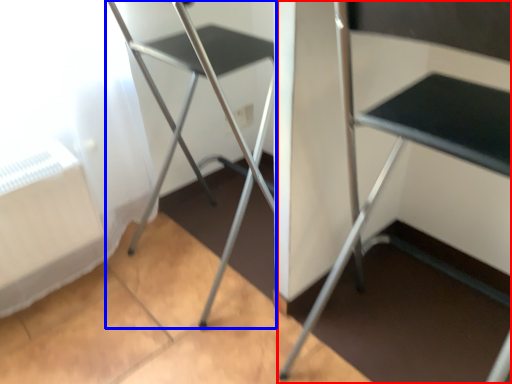
Question: Which object is further to the camera taking this photo, furniture (highlighted by a red box) or chair (highlighted by a blue box)?

Choices:
 (A) furniture
 (B) chair

Answer: (B)